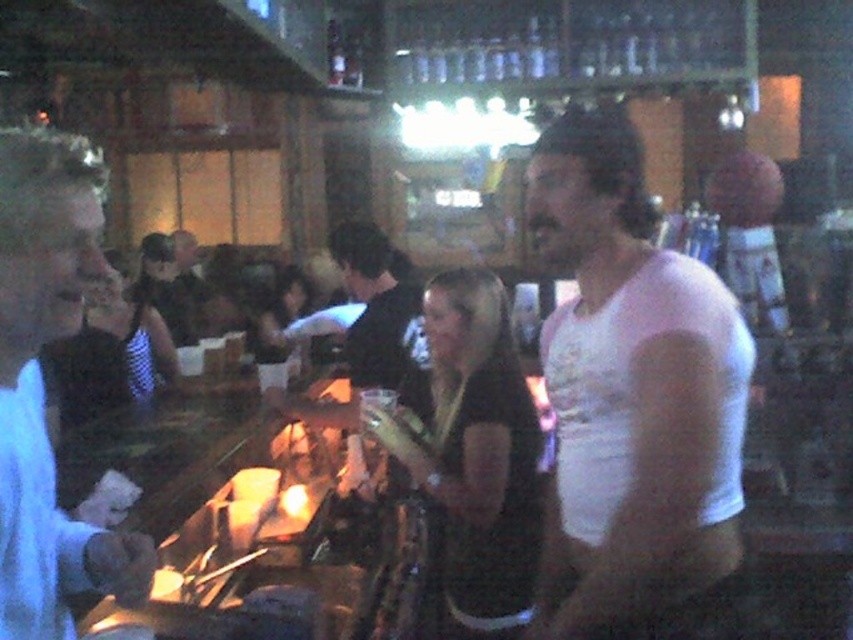
Consider the image. Between black matte dress at center and black shirt at center, which one is positioned higher?

black shirt at center is higher up.

Does black matte dress at center have a greater width compared to black shirt at center?

Yes, black matte dress at center is wider than black shirt at center.

Describe the element at coordinates (474, 458) in the screenshot. I see `black matte dress at center` at that location.

At what (x,y) coordinates should I click in order to perform the action: click on black matte dress at center. Please return your answer as a coordinate pair (x, y). Looking at the image, I should click on (474, 458).

Is point (444, 614) in front of point (169, 326)?

Yes.

Find the location of `black matte dress at center`. black matte dress at center is located at coordinates (474, 458).

Can you confirm if white cotton t-shirt at right is positioned to the left of black shirt at center?

No, white cotton t-shirt at right is not to the left of black shirt at center.

Does white cotton t-shirt at right have a greater height compared to black shirt at center?

Yes, white cotton t-shirt at right is taller than black shirt at center.

Between point (634, 385) and point (363, 342), which one is positioned in front?

Positioned in front is point (634, 385).

I want to click on white cotton t-shirt at right, so (x=630, y=392).